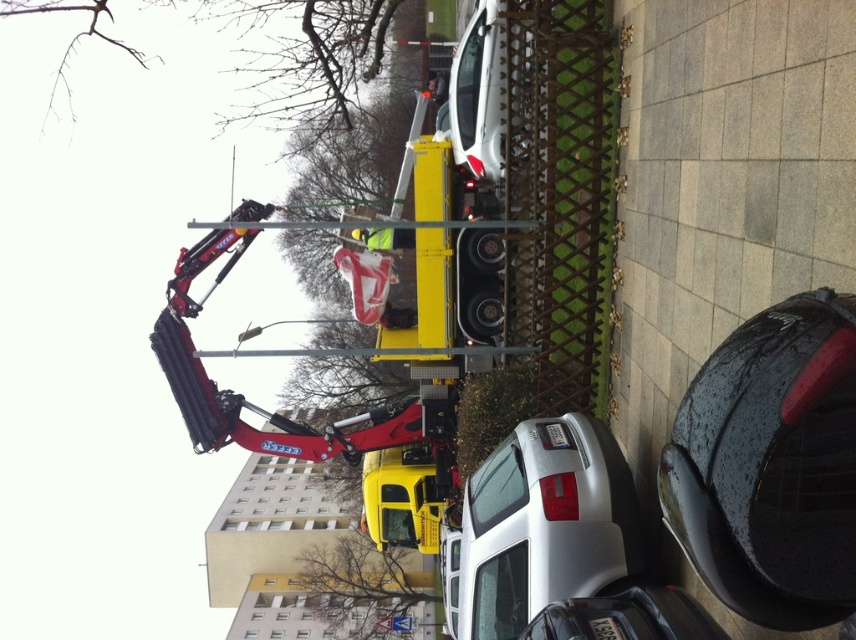
You are a delivery person trying to load a package that requires a clearance of 2 meters. You see the satin silver car at center and the yellow matte truck at center. Which vehicle can you safely load the package onto without exceeding the height limit?

The satin silver car at center has a greater height compared to the yellow matte truck at center. Therefore, the package can be safely loaded onto the satin silver car at center as it meets the 2 meters clearance requirement.

You are a delivery person standing at the pedestrian crossing, and you need to deliver a package to the driver of the satin silver car at center and the yellow matte truck at center. Which vehicle is closer to you?

The satin silver car at center is 15.05 meters away from the yellow matte truck at center. However, since both vehicles are at the center, their distance from the pedestrian crossing isn